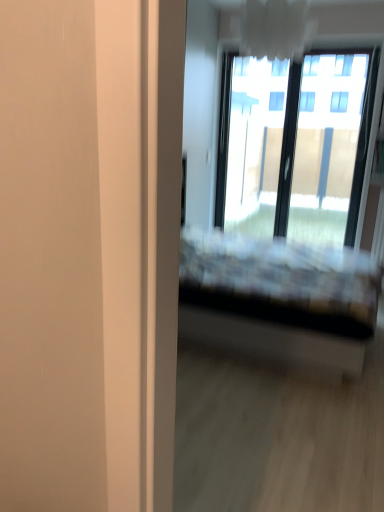
Question: Considering the relative sizes of plaid fabric bed at center and transparent glass window at upper right in the image provided, is plaid fabric bed at center shorter than transparent glass window at upper right?

Choices:
 (A) no
 (B) yes

Answer: (B)

Question: Is plaid fabric bed at center closer to camera compared to transparent glass window at upper right?

Choices:
 (A) no
 (B) yes

Answer: (B)

Question: Is transparent glass window at upper right located within plaid fabric bed at center?

Choices:
 (A) no
 (B) yes

Answer: (A)

Question: Does plaid fabric bed at center have a lesser width compared to transparent glass window at upper right?

Choices:
 (A) yes
 (B) no

Answer: (B)

Question: Can you confirm if plaid fabric bed at center is smaller than transparent glass window at upper right?

Choices:
 (A) yes
 (B) no

Answer: (B)

Question: Is plaid fabric bed at center positioned beyond the bounds of transparent glass window at upper right?

Choices:
 (A) yes
 (B) no

Answer: (A)

Question: Does transparent glass window at upper right have a lesser width compared to plaid fabric bed at center?

Choices:
 (A) no
 (B) yes

Answer: (B)

Question: From a real-world perspective, is transparent glass window at upper right physically below plaid fabric bed at center?

Choices:
 (A) no
 (B) yes

Answer: (A)

Question: Is plaid fabric bed at center at the back of transparent glass window at upper right?

Choices:
 (A) yes
 (B) no

Answer: (B)

Question: Is transparent glass window at upper right positioned beyond the bounds of plaid fabric bed at center?

Choices:
 (A) yes
 (B) no

Answer: (A)

Question: Considering the relative sizes of transparent glass window at upper right and plaid fabric bed at center in the image provided, is transparent glass window at upper right smaller than plaid fabric bed at center?

Choices:
 (A) yes
 (B) no

Answer: (A)

Question: Is transparent glass window at upper right with plaid fabric bed at center?

Choices:
 (A) yes
 (B) no

Answer: (B)

Question: Looking at their shapes, would you say transparent glass window at upper right is wider or thinner than plaid fabric bed at center?

Choices:
 (A) wide
 (B) thin

Answer: (B)